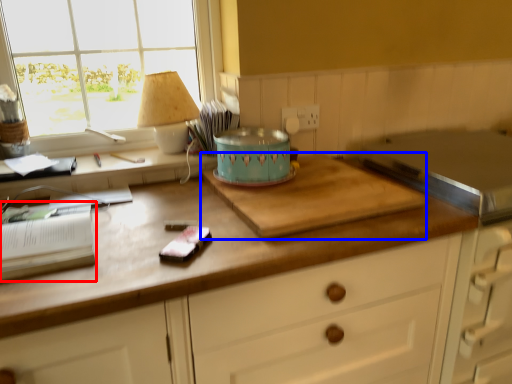
Question: Which object appears closest to the camera in this image, book (highlighted by a red box) or cutting board (highlighted by a blue box)?

Choices:
 (A) book
 (B) cutting board

Answer: (A)